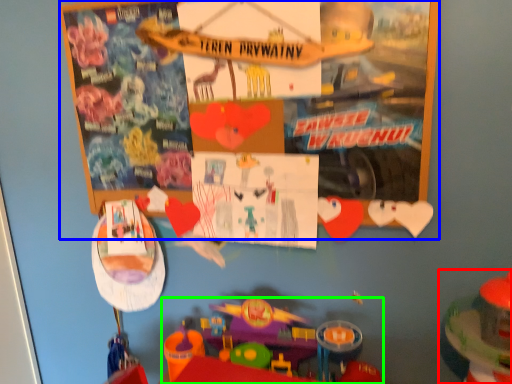
Question: Which is nearer to the toy (highlighted by a red box)? bulletin board (highlighted by a blue box) or toy (highlighted by a green box).

Choices:
 (A) bulletin board
 (B) toy

Answer: (B)